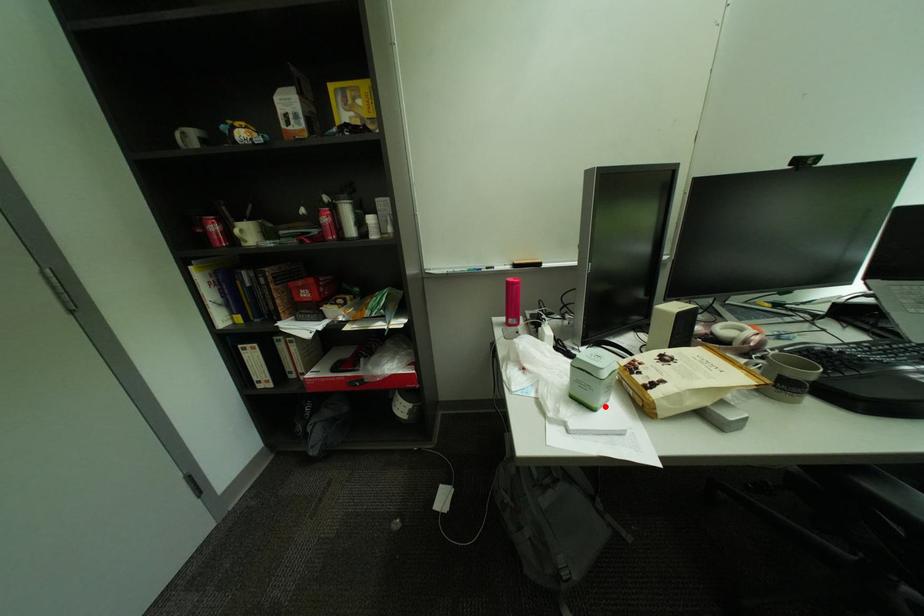
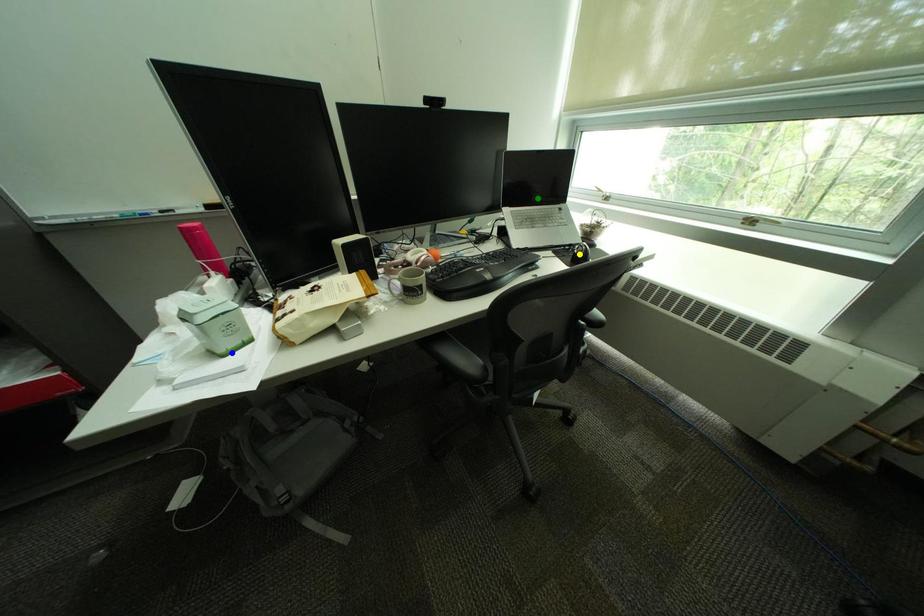
Question: I am providing you with two images of the same scene from different viewpoints. A red point is marked on the first image. You are given multiple points on the second image. Which spot in image 2 lines up with the point in image 1?

Choices:
 (A) yellow point
 (B) green point
 (C) blue point

Answer: (C)